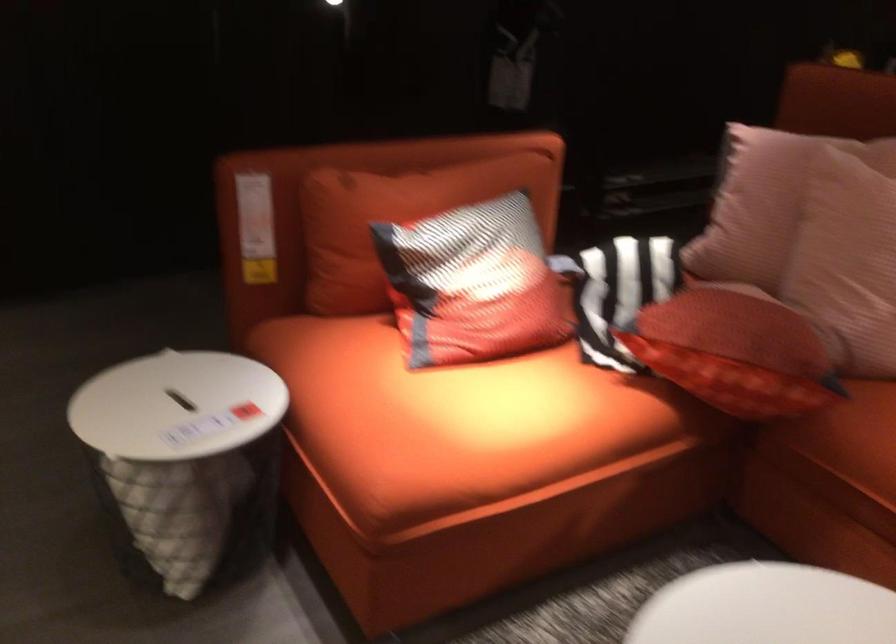
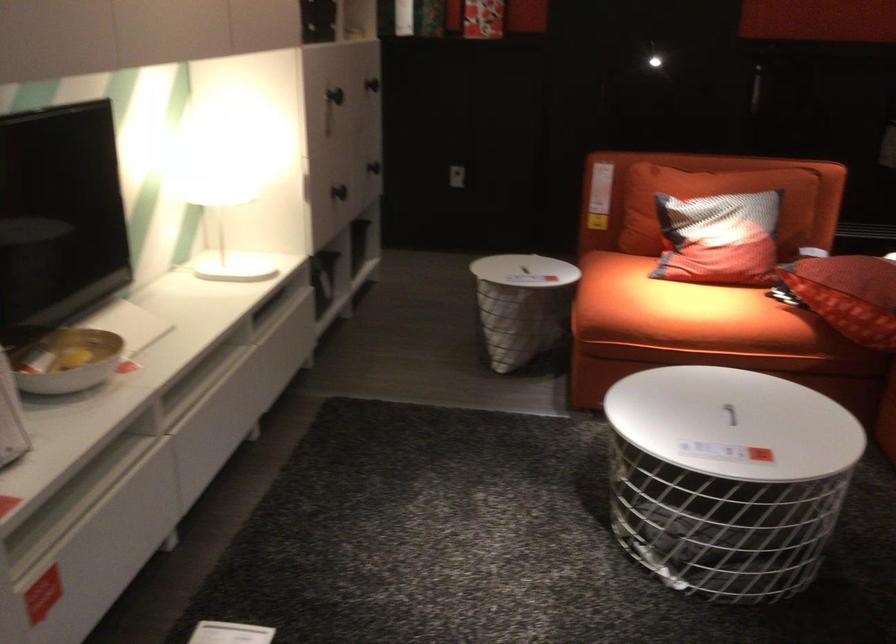
Where in the second image is the point corresponding to the point at 487,299 from the first image?

(719, 239)